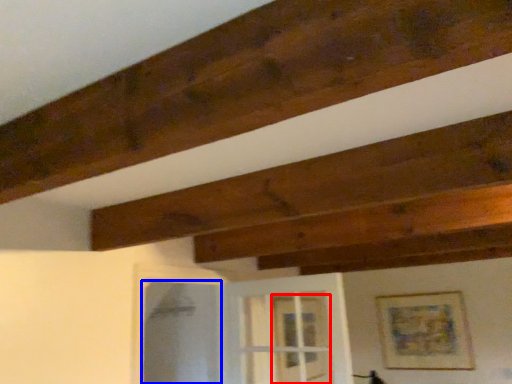
Question: Which object appears closest to the camera in this image, glass door (highlighted by a red box) or screen door (highlighted by a blue box)?

Choices:
 (A) glass door
 (B) screen door

Answer: (B)